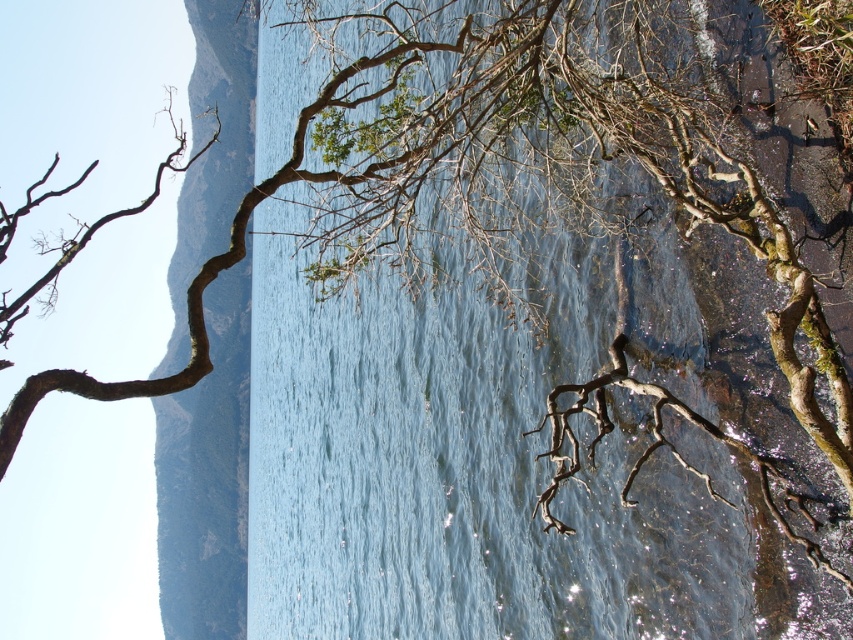
Is clear water at center bigger than brown rough cliff at left?

Actually, clear water at center might be smaller than brown rough cliff at left.

Is clear water at center to the right of brown rough cliff at left from the viewer's perspective?

Yes, clear water at center is to the right of brown rough cliff at left.

Does point (535, 109) come behind point (212, 584)?

That is False.

Image resolution: width=853 pixels, height=640 pixels. What are the coordinates of `clear water at center` in the screenshot? It's located at (560, 348).